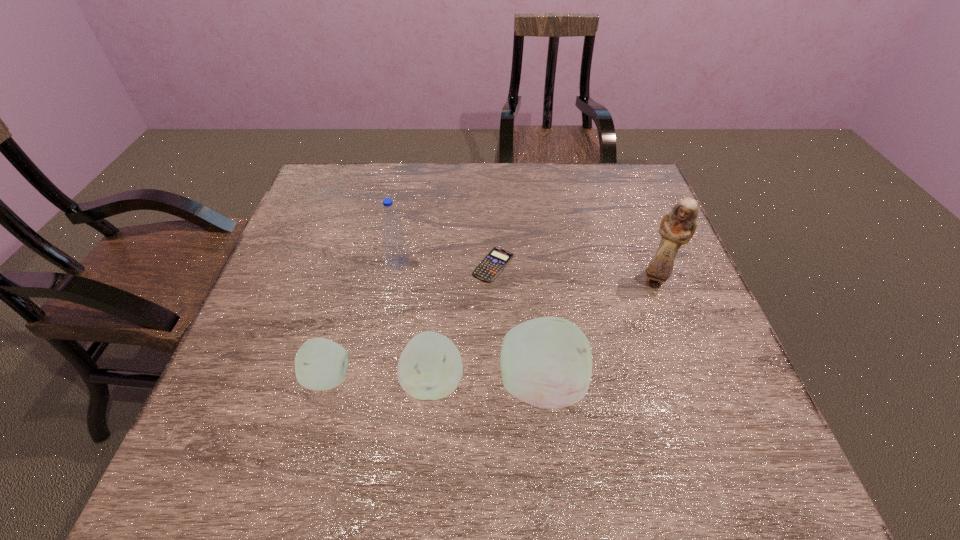
Find the location of a particular element. This screenshot has height=540, width=960. vacant spot to place a apple on the right is located at coordinates (646, 389).